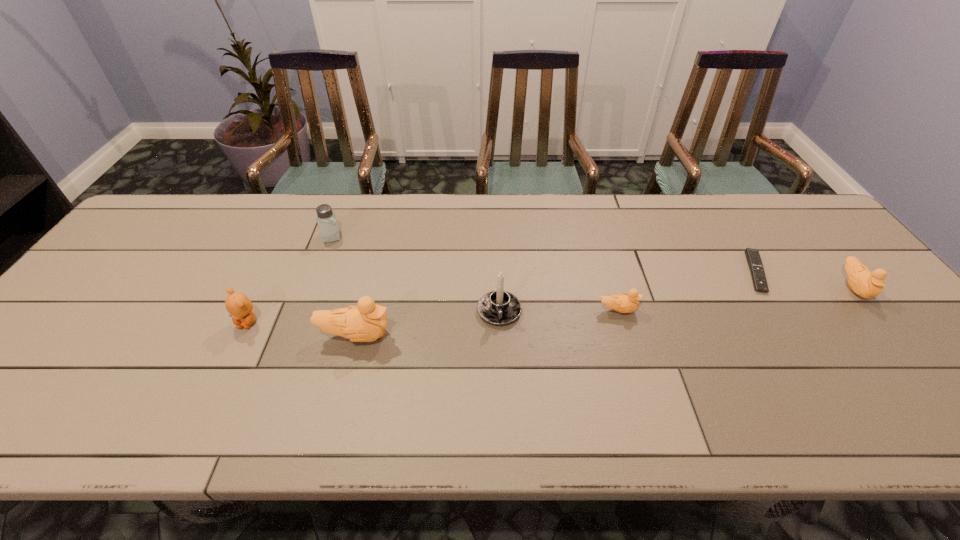
You are a GUI agent. You are given a task and a screenshot of the screen. Output one action in this format:
    pyautogui.click(x=<x>, y=<y>)
    Task: Click on the free space between the leftmost object and the second shortest object
    Image resolution: width=960 pixels, height=540 pixels.
    Given the screenshot: What is the action you would take?
    pyautogui.click(x=433, y=316)

Where is `vacant area between the nearest duckling and the second duckling from left to right`? The height and width of the screenshot is (540, 960). vacant area between the nearest duckling and the second duckling from left to right is located at coordinates (487, 323).

I want to click on free space between the teddy bear and the second shortest duckling, so click(551, 305).

Where is `free space between the shortest duckling and the candle holder`? This screenshot has width=960, height=540. free space between the shortest duckling and the candle holder is located at coordinates (559, 310).

Locate an element on the screen. vacant area that lies between the fifth object from right to left and the sixth tallest object is located at coordinates (487, 323).

The height and width of the screenshot is (540, 960). I want to click on vacant area that lies between the fourth object from right to left and the sixth object from right to left, so click(416, 274).

Find the location of `the third closest object to the fourth object from left to right`. the third closest object to the fourth object from left to right is located at coordinates (329, 229).

Locate which object ranks fourth in proximity to the fifth object from right to left. Please provide its 2D coordinates. Your answer should be formatted as a tuple, i.e. [(x, y)], where the tuple contains the x and y coordinates of a point satisfying the conditions above.

[(624, 303)]

Find the location of a particular element. This screenshot has height=540, width=960. duckling that is the closest to the second object from right to left is located at coordinates (867, 284).

Locate which duckling ranks third in proximity to the saltshaker. Please provide its 2D coordinates. Your answer should be formatted as a tuple, i.e. [(x, y)], where the tuple contains the x and y coordinates of a point satisfying the conditions above.

[(867, 284)]